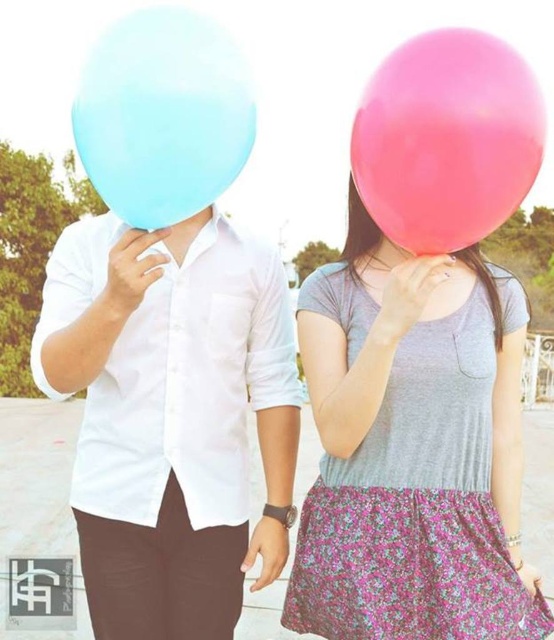
Question: Can you confirm if white matte shirt at left is positioned below matte blue balloon at upper left?

Choices:
 (A) yes
 (B) no

Answer: (A)

Question: Can you confirm if matte pink balloon at center is bigger than pink rubber balloon at upper right?

Choices:
 (A) no
 (B) yes

Answer: (B)

Question: Based on their relative distances, which object is farther from the matte blue balloon at upper left?

Choices:
 (A) white matte shirt at left
 (B) matte pink balloon at center
 (C) pink rubber balloon at upper right

Answer: (B)

Question: Does pink rubber balloon at upper right appear over matte blue balloon at upper left?

Choices:
 (A) no
 (B) yes

Answer: (A)

Question: Among these objects, which one is nearest to the camera?

Choices:
 (A) white matte shirt at left
 (B) matte pink balloon at center
 (C) matte blue balloon at upper left
 (D) pink rubber balloon at upper right

Answer: (D)

Question: Which object appears farthest from the camera in this image?

Choices:
 (A) white matte shirt at left
 (B) matte pink balloon at center
 (C) matte blue balloon at upper left
 (D) pink rubber balloon at upper right

Answer: (A)